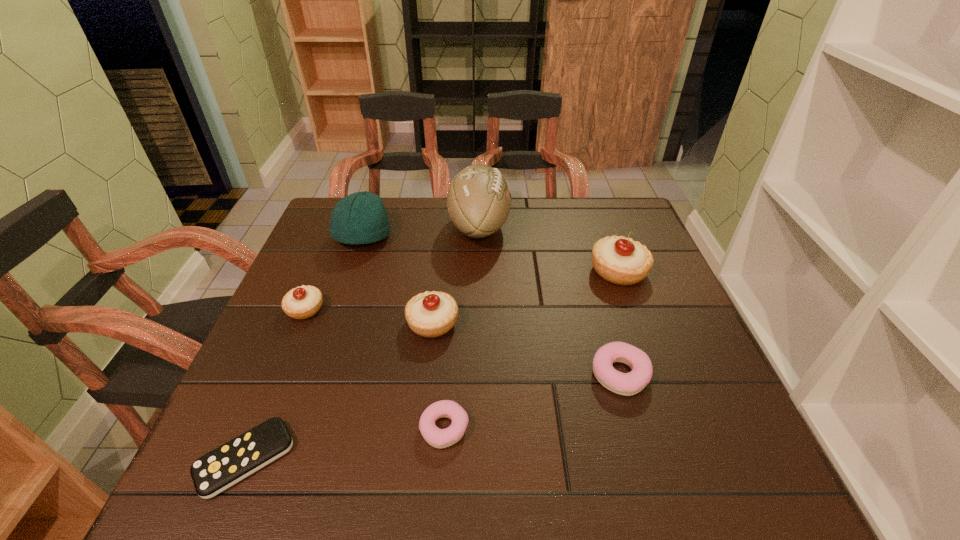
The width and height of the screenshot is (960, 540). Find the location of `beige pastry that is the second closest to the football (American)`. beige pastry that is the second closest to the football (American) is located at coordinates (622, 261).

Where is `beige pastry that is the closest to the leftmost pastry`? beige pastry that is the closest to the leftmost pastry is located at coordinates (432, 314).

Find the location of a particular element. free region that satisfies the following two spatial constraints: 1. on the laces of the biggest beige pastry; 2. on the right side of the tallest object is located at coordinates (479, 271).

Identify the location of free space that satisfies the following two spatial constraints: 1. on the laces of the football (American); 2. on the front side of the shortest object. (478, 459).

Where is `free space that satisfies the following two spatial constraints: 1. on the back side of the third nearest object; 2. on the left side of the smaller pink pastry`? This screenshot has width=960, height=540. free space that satisfies the following two spatial constraints: 1. on the back side of the third nearest object; 2. on the left side of the smaller pink pastry is located at coordinates (448, 374).

Find the location of a particular element. The image size is (960, 540). vacant area that satisfies the following two spatial constraints: 1. on the back side of the shortest pastry; 2. on the right side of the sixth tallest object is located at coordinates (448, 374).

Identify the location of blank area in the image that satisfies the following two spatial constraints: 1. on the front side of the fourth shortest object; 2. on the right side of the bigger pink pastry. coord(278,374).

I want to click on free spot that satisfies the following two spatial constraints: 1. on the front side of the second biggest beige pastry; 2. on the right side of the beanie, so (x=334, y=323).